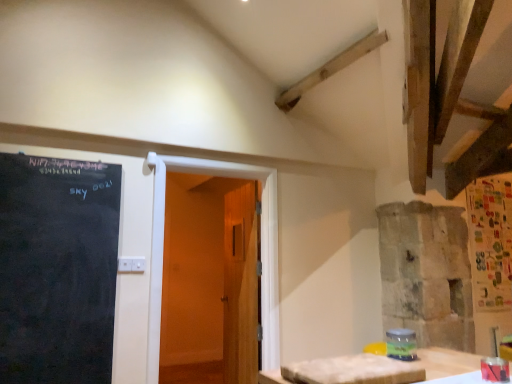
Question: From a real-world perspective, is wooden door at center, which ranks as the second door in back-to-front order, positioned above or below blackboard at left?

Choices:
 (A) above
 (B) below

Answer: (B)

Question: Considering the positions of wooden door at center, the 1th door in the front-to-back sequence, and blackboard at left in the image, is wooden door at center, the 1th door in the front-to-back sequence, bigger or smaller than blackboard at left?

Choices:
 (A) big
 (B) small

Answer: (A)

Question: Estimate the real-world distances between objects in this image. Which object is closer to the wooden door at center, acting as the second door starting from the front?

Choices:
 (A) white textured table at lower right
 (B) blackboard at left
 (C) wooden door at center, the 1th door in the front-to-back sequence

Answer: (C)

Question: Which of these objects is positioned farthest from the white textured table at lower right?

Choices:
 (A) blackboard at left
 (B) wooden door at center, acting as the second door starting from the front
 (C) wooden door at center, the 1th door in the front-to-back sequence

Answer: (A)